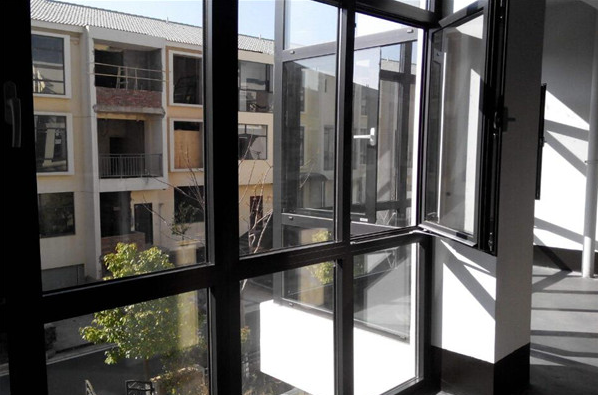
Where is `silver handle`? silver handle is located at coordinates (370, 132).